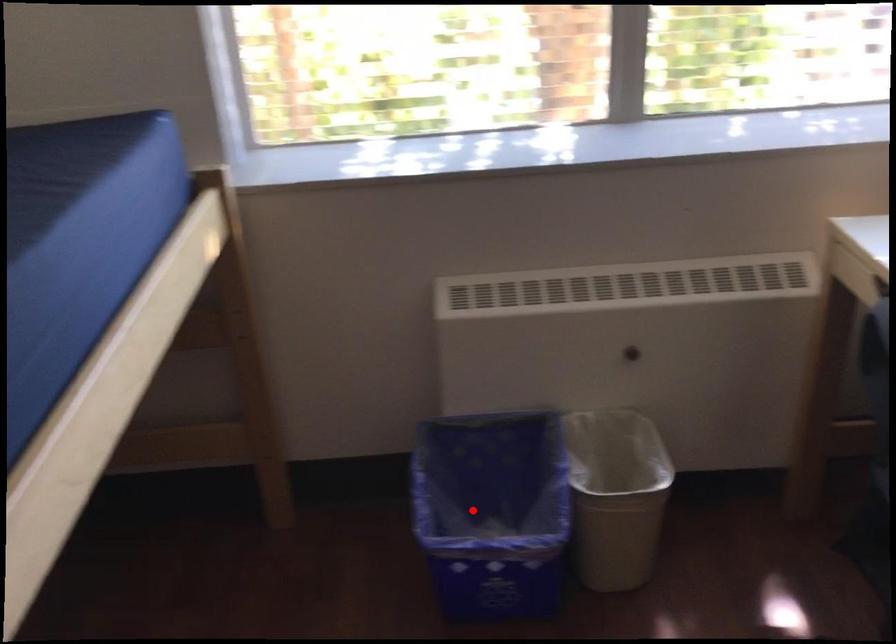
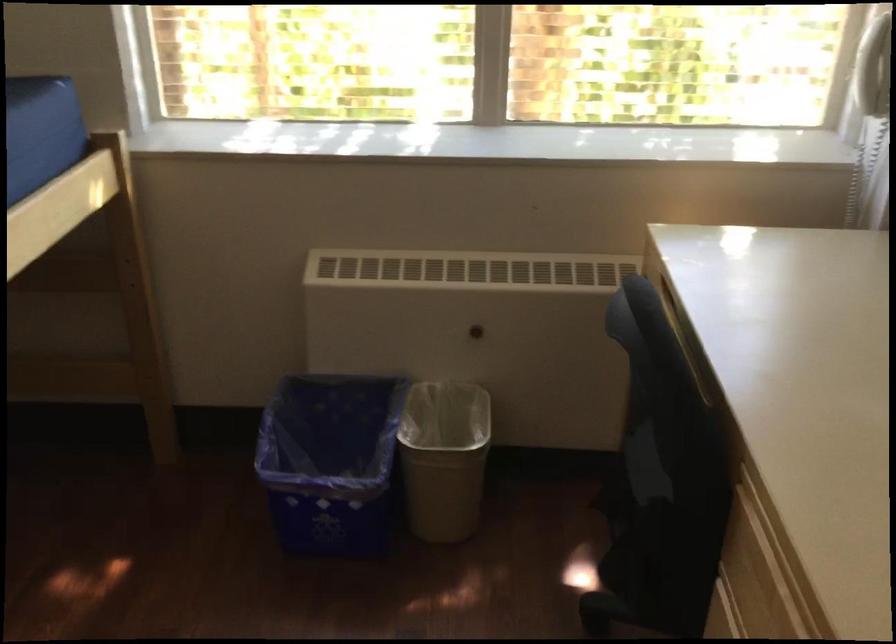
Question: I am providing you with two images of the same scene from different viewpoints. A red point is marked on the first image. At the location where the point appears in image 1, is it still visible in image 2?

Choices:
 (A) Yes
 (B) No

Answer: (A)